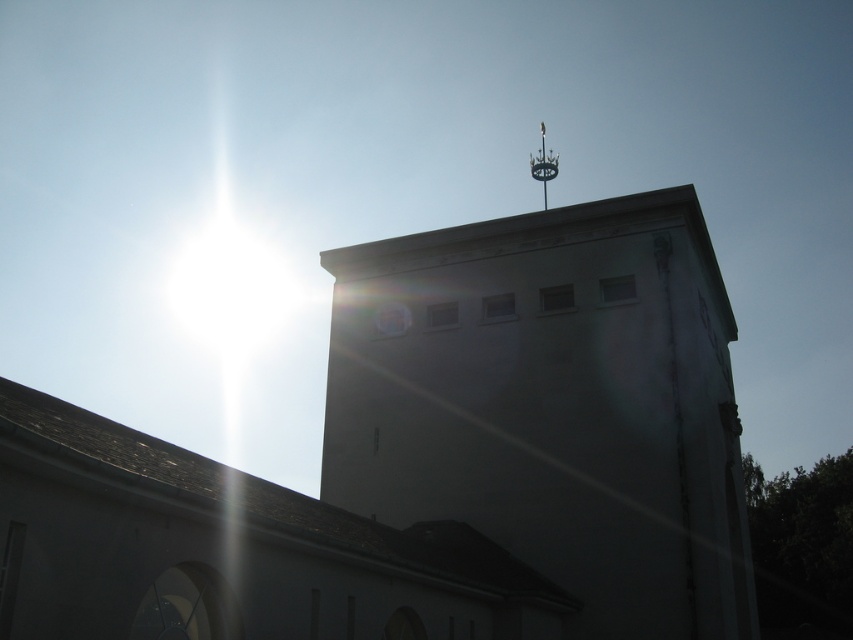
Can you confirm if white matte tower at upper center is taller than polished metal spire at upper center?

No.

Can you confirm if white matte tower at upper center is positioned to the right of polished metal spire at upper center?

Incorrect, white matte tower at upper center is not on the right side of polished metal spire at upper center.

Image resolution: width=853 pixels, height=640 pixels. I want to click on white matte tower at upper center, so click(x=428, y=460).